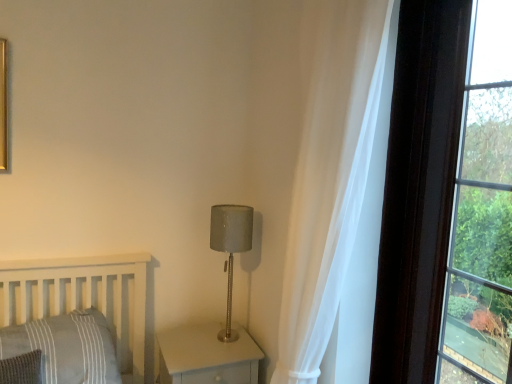
Question: Considering the positions of matte gray wood nightstand at lower center and gray striped pillow at lower left in the image, is matte gray wood nightstand at lower center bigger or smaller than gray striped pillow at lower left?

Choices:
 (A) small
 (B) big

Answer: (B)

Question: From the image's perspective, relative to gray striped pillow at lower left, is matte gray wood nightstand at lower center above or below?

Choices:
 (A) above
 (B) below

Answer: (B)

Question: Considering the real-world distances, which object is farthest from the dark brown wood frame at right?

Choices:
 (A) gray striped pillow at lower left
 (B) matte gray wood nightstand at lower center
 (C) satin gray lampshade at center
 (D) white sheer curtain at right

Answer: (A)

Question: Based on their relative distances, which object is nearer to the satin gray lampshade at center?

Choices:
 (A) matte gray wood nightstand at lower center
 (B) dark brown wood frame at right
 (C) gray striped pillow at lower left
 (D) white sheer curtain at right

Answer: (A)